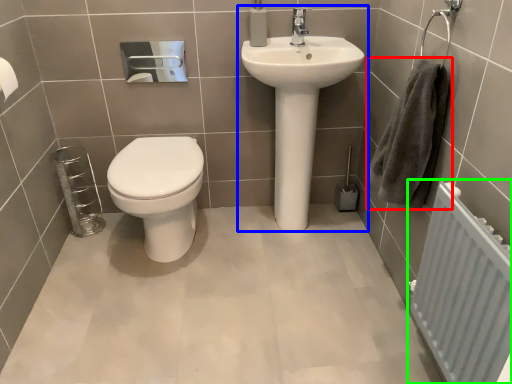
Question: Estimate the real-world distances between objects in this image. Which object is farther from hand towel (highlighted by a red box), sink (highlighted by a blue box) or radiator (highlighted by a green box)?

Choices:
 (A) sink
 (B) radiator

Answer: (A)